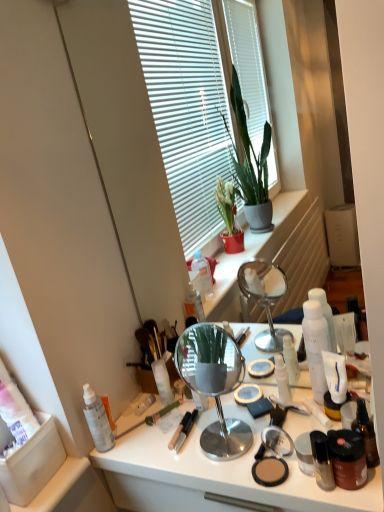
The image size is (384, 512). I want to click on vacant area that is in front of green plastic paint brush at lower left, so click(x=159, y=451).